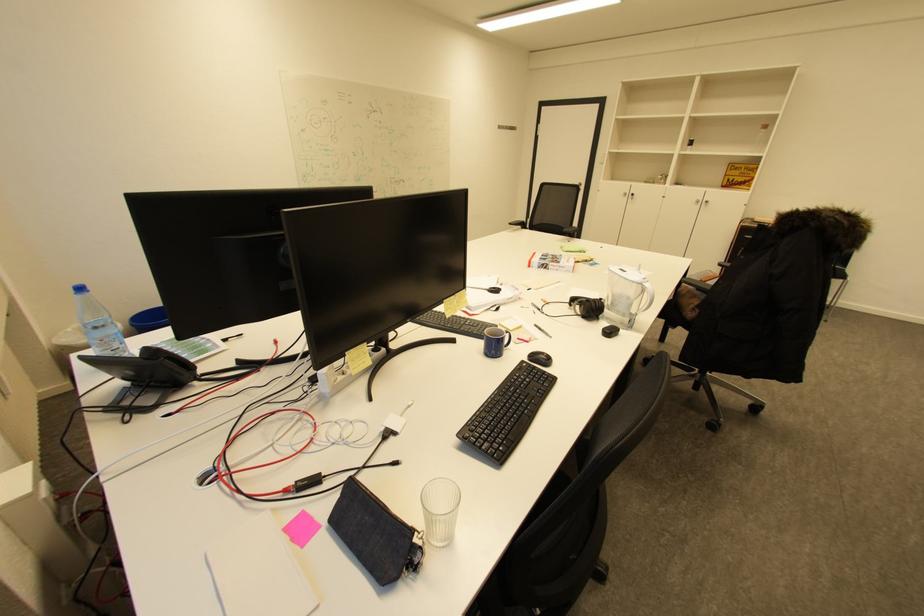
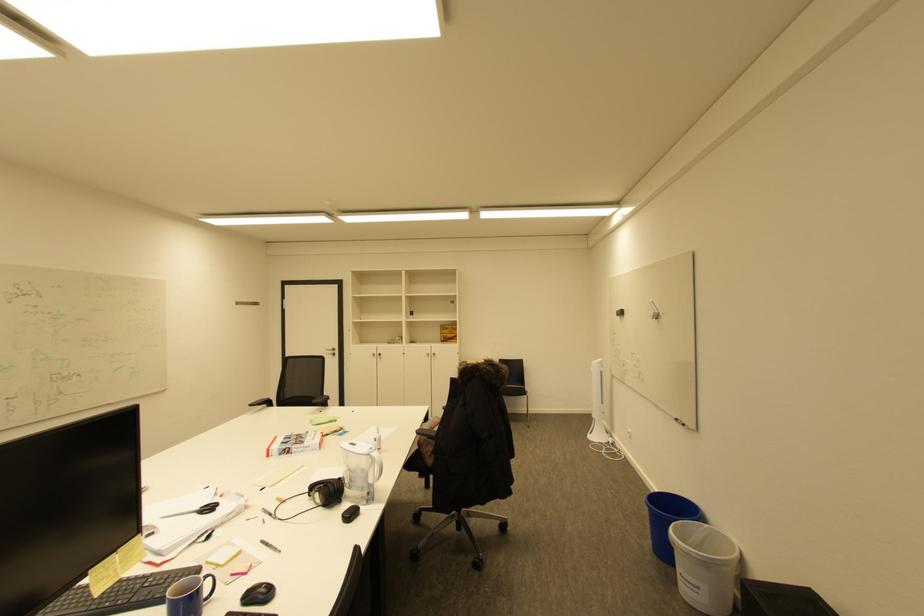
First-person continuous shooting, in which direction is the camera rotating?

The rotation direction of the camera is right-up.